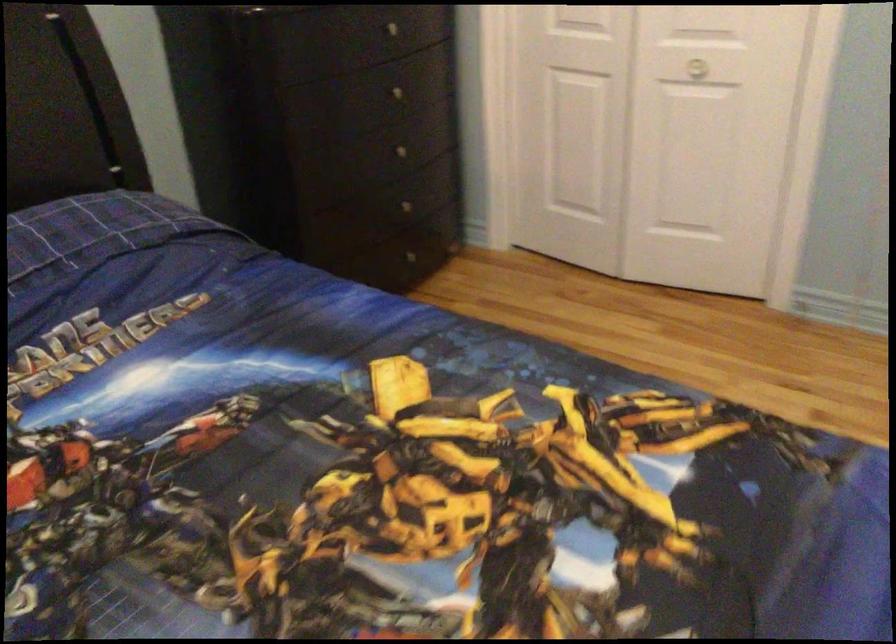
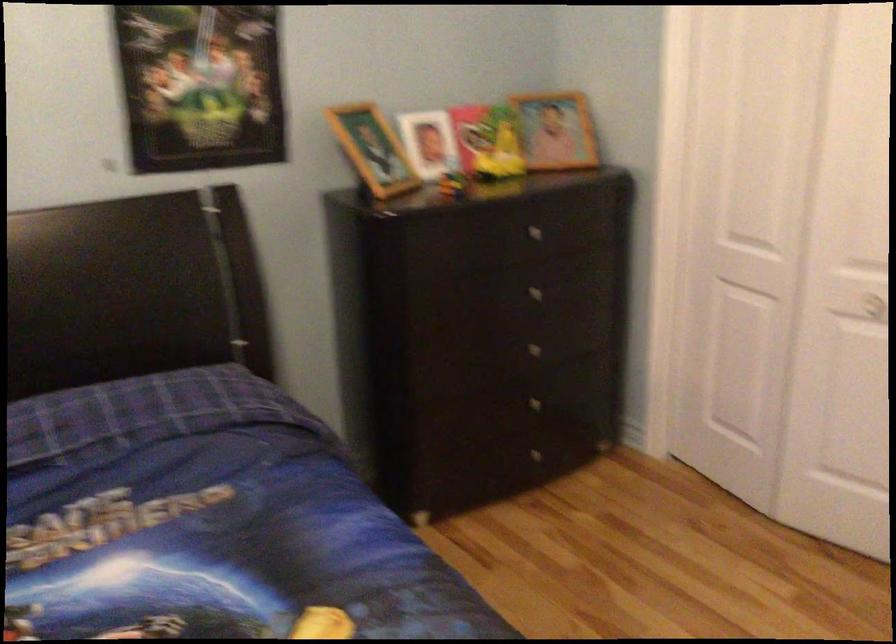
In the second image, find the point that corresponds to the point at 403,156 in the first image.

(539, 353)